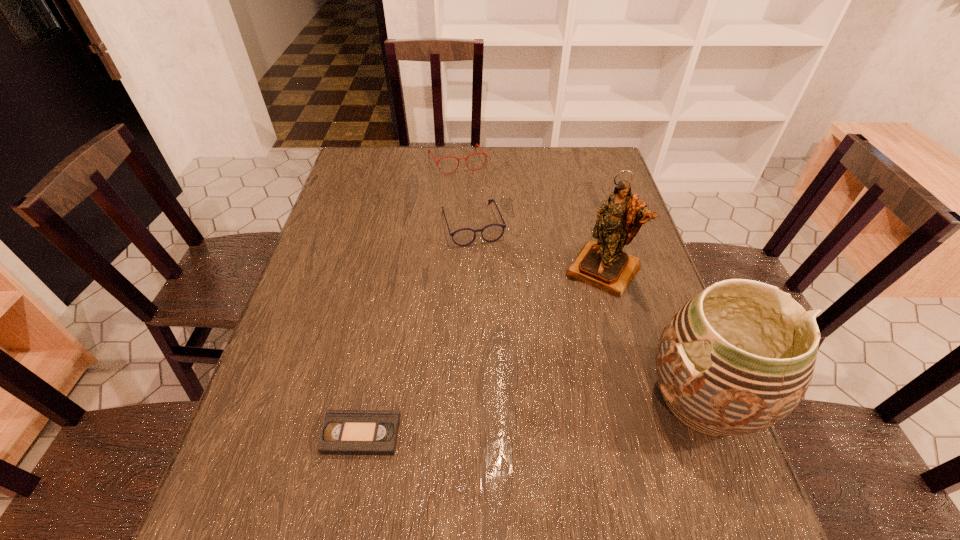
Locate an element on the screen. This screenshot has height=540, width=960. free space that satisfies the following two spatial constraints: 1. on the front side of the figurine; 2. on the right side of the farther spectacles is located at coordinates (450, 269).